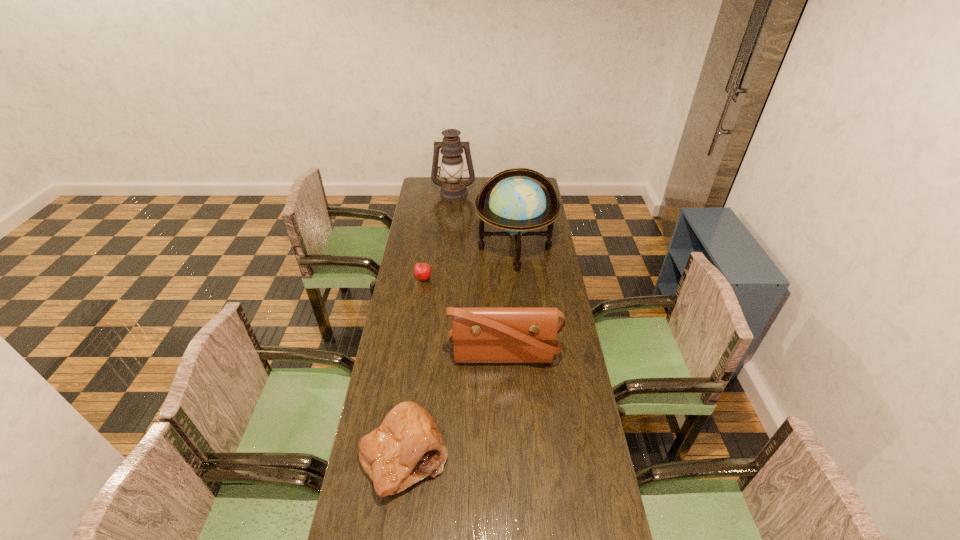
Where is `globe`? This screenshot has width=960, height=540. globe is located at coordinates (517, 204).

In order to click on oil lamp in this screenshot , I will do `click(452, 189)`.

Where is `the second nearest object`? This screenshot has width=960, height=540. the second nearest object is located at coordinates (479, 334).

Locate an element on the screen. satchel is located at coordinates (479, 334).

You are a GUI agent. You are given a task and a screenshot of the screen. Output one action in this format:
    pyautogui.click(x=<x>, y=<y>)
    Task: Click on the second shortest object
    The width and height of the screenshot is (960, 540).
    Given the screenshot: What is the action you would take?
    [x=407, y=447]

At what (x,y) coordinates should I click in order to perform the action: click on the nearest object. Please return your answer as a coordinate pair (x, y). The height and width of the screenshot is (540, 960). Looking at the image, I should click on pyautogui.click(x=407, y=447).

The image size is (960, 540). I want to click on apple, so click(x=422, y=271).

I want to click on vacant region located on the surface of the globe, so click(519, 295).

I want to click on free space located on the right of the farthest object, so click(494, 193).

Identify the location of free spot located 0.170m on the front flap of the third tallest object. Image resolution: width=960 pixels, height=540 pixels. (508, 415).